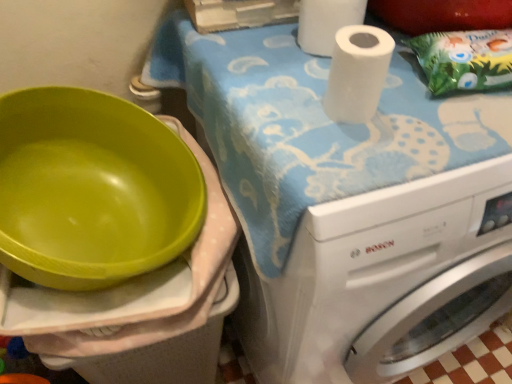
Find the location of a particular element. The width and height of the screenshot is (512, 384). vacant area that lies between white matte paper towel at upper center, placed as the 1th paper towel when sorted from front to back, and green paper bag at upper right is located at coordinates (416, 97).